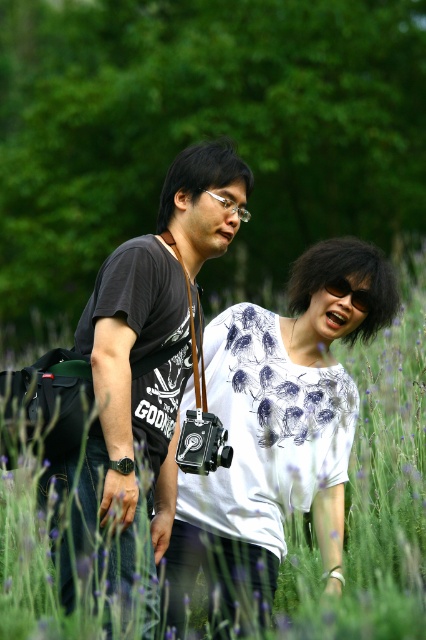
Question: Which point is closer to the camera?

Choices:
 (A) black matte sunglasses at center
 (B) white printed shirt at center
 (C) clear plastic glasses at center

Answer: (C)

Question: Observing the image, what is the correct spatial positioning of white printed shirt at center in reference to black matte camera at center?

Choices:
 (A) left
 (B) right

Answer: (B)

Question: Where is black matte sunglasses at center located in relation to clear plastic glasses at center in the image?

Choices:
 (A) below
 (B) above

Answer: (A)

Question: Is black matte camera at center smaller than clear plastic glasses at center?

Choices:
 (A) yes
 (B) no

Answer: (B)

Question: Which point is farther to the camera?

Choices:
 (A) white printed shirt at center
 (B) black matte sunglasses at center
 (C) clear plastic glasses at center
 (D) black matte camera at center

Answer: (B)

Question: Which object appears farthest from the camera in this image?

Choices:
 (A) black matte sunglasses at center
 (B) clear plastic glasses at center
 (C) black matte camera at center

Answer: (A)